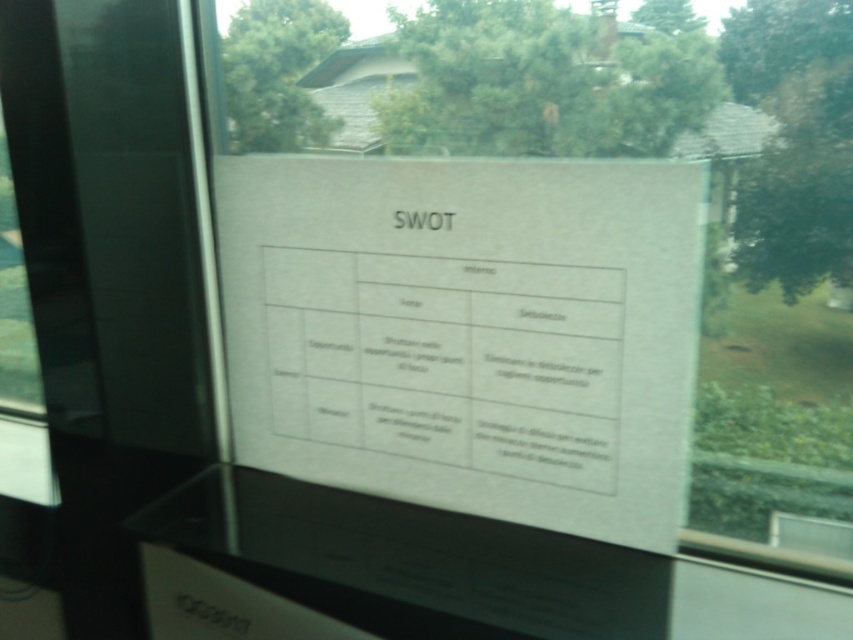
Does transparent glass window at center have a greater width compared to white paper at upper center?

Yes, transparent glass window at center is wider than white paper at upper center.

Between point (476, 65) and point (442, 227), which one is positioned in front?

Positioned in front is point (442, 227).

Image resolution: width=853 pixels, height=640 pixels. Describe the element at coordinates (531, 337) in the screenshot. I see `transparent glass window at center` at that location.

The height and width of the screenshot is (640, 853). I want to click on transparent glass window at center, so click(531, 337).